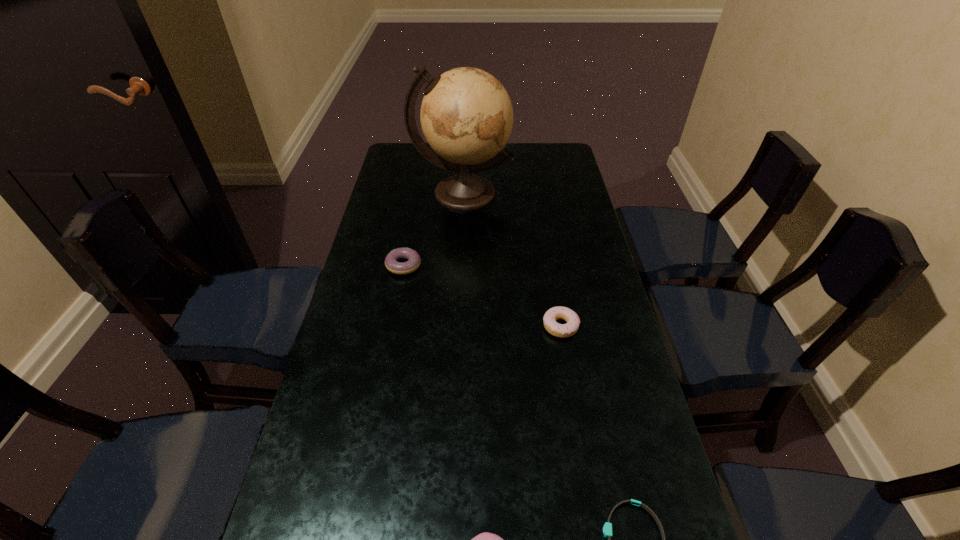
Where is `globe at the left edge`? This screenshot has height=540, width=960. globe at the left edge is located at coordinates point(466,115).

At what (x,y) coordinates should I click in order to perform the action: click on doughnut that is at the left edge. Please return your answer as a coordinate pair (x, y). This screenshot has width=960, height=540. Looking at the image, I should click on (401, 268).

Image resolution: width=960 pixels, height=540 pixels. Find the location of `object present at the right edge`. object present at the right edge is located at coordinates (571, 327).

Find the location of a particular element. The image size is (960, 540). object located at the far left corner is located at coordinates (466, 115).

Find the location of a particular element. The height and width of the screenshot is (540, 960). vacant space at the far edge is located at coordinates (516, 160).

Find the location of a particular element. free space at the left edge is located at coordinates (389, 349).

The height and width of the screenshot is (540, 960). In the image, there is a desktop. Find the location of `vacant area at the right edge`. vacant area at the right edge is located at coordinates (564, 218).

Where is `free region at the far left corner`? This screenshot has width=960, height=540. free region at the far left corner is located at coordinates (407, 144).

The image size is (960, 540). In order to click on vacant region between the second farthest doughnut and the leftmost doughnut in this screenshot , I will do `click(482, 296)`.

Find the location of a particular element. This screenshot has width=960, height=540. object that is the second closest to the globe is located at coordinates (571, 327).